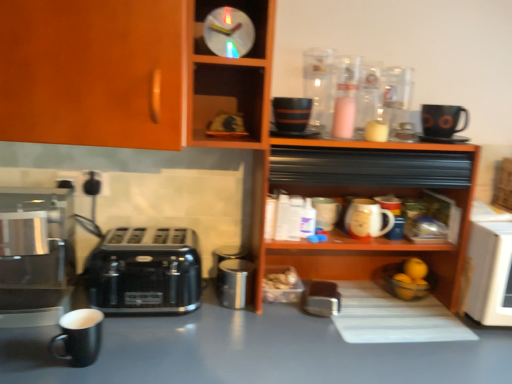
Question: Does wooden shelf at upper center have a greater width compared to shiny metallic coffee maker at left?

Choices:
 (A) no
 (B) yes

Answer: (A)

Question: From a real-world perspective, is wooden shelf at upper center physically below shiny metallic coffee maker at left?

Choices:
 (A) no
 (B) yes

Answer: (A)

Question: Is wooden shelf at upper center taller than shiny metallic coffee maker at left?

Choices:
 (A) no
 (B) yes

Answer: (B)

Question: Is wooden shelf at upper center at the right side of shiny metallic coffee maker at left?

Choices:
 (A) no
 (B) yes

Answer: (B)

Question: From the image's perspective, is wooden shelf at upper center under shiny metallic coffee maker at left?

Choices:
 (A) yes
 (B) no

Answer: (B)

Question: Considering the relative sizes of wooden shelf at upper center and shiny metallic coffee maker at left in the image provided, is wooden shelf at upper center bigger than shiny metallic coffee maker at left?

Choices:
 (A) no
 (B) yes

Answer: (B)

Question: From a real-world perspective, is black matte mug at lower left on top of wooden cabinet at upper left, which ranks as the second cabinetry in right-to-left order?

Choices:
 (A) yes
 (B) no

Answer: (B)

Question: Is black matte mug at lower left thinner than wooden cabinet at upper left, the first cabinetry in the left-to-right sequence?

Choices:
 (A) no
 (B) yes

Answer: (B)

Question: From a real-world perspective, is black matte mug at lower left positioned under wooden cabinet at upper left, which ranks as the second cabinetry in right-to-left order, based on gravity?

Choices:
 (A) no
 (B) yes

Answer: (B)

Question: Is black matte mug at lower left taller than wooden cabinet at upper left, the first cabinetry in the left-to-right sequence?

Choices:
 (A) no
 (B) yes

Answer: (A)

Question: Is black matte mug at lower left oriented away from wooden cabinet at upper left, the first cabinetry in the left-to-right sequence?

Choices:
 (A) yes
 (B) no

Answer: (B)

Question: Considering the relative sizes of black matte mug at lower left and wooden cabinet at upper left, the first cabinetry in the left-to-right sequence, in the image provided, is black matte mug at lower left wider than wooden cabinet at upper left, the first cabinetry in the left-to-right sequence,?

Choices:
 (A) no
 (B) yes

Answer: (A)

Question: From a real-world perspective, is matte ceramic mug at shelf center on top of wooden shelf at upper center?

Choices:
 (A) no
 (B) yes

Answer: (A)